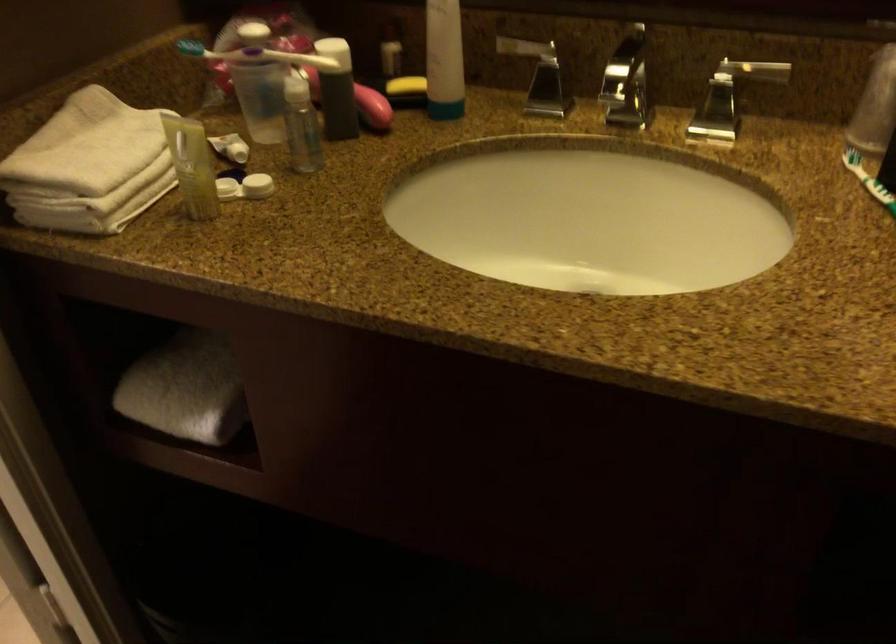
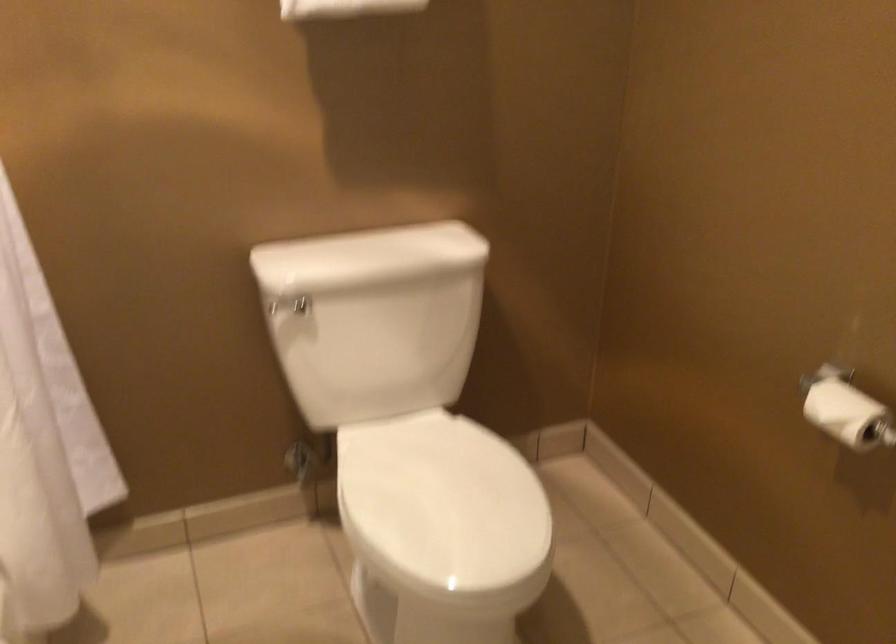
Question: The first image is from the beginning of the video and the second image is from the end. How did the camera likely rotate when shooting the video?

Choices:
 (A) Left
 (B) Right
 (C) Up
 (D) Down

Answer: (A)